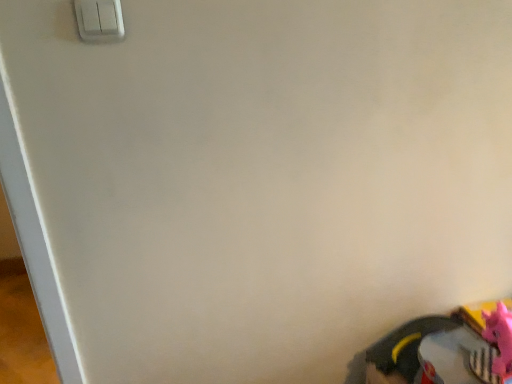
Question: Do you think rubberized black shoe at lower right is within pink rubber toy at lower right, or outside of it?

Choices:
 (A) outside
 (B) inside

Answer: (A)

Question: From a real-world perspective, is rubberized black shoe at lower right physically located above or below pink rubber toy at lower right?

Choices:
 (A) below
 (B) above

Answer: (A)

Question: Based on their relative distances, which object is farther from the rubberized black shoe at lower right?

Choices:
 (A) pink rubber toy at lower right
 (B) white plastic light switch at upper left

Answer: (B)

Question: Based on their relative distances, which object is nearer to the white plastic light switch at upper left?

Choices:
 (A) rubberized black shoe at lower right
 (B) pink rubber toy at lower right

Answer: (B)